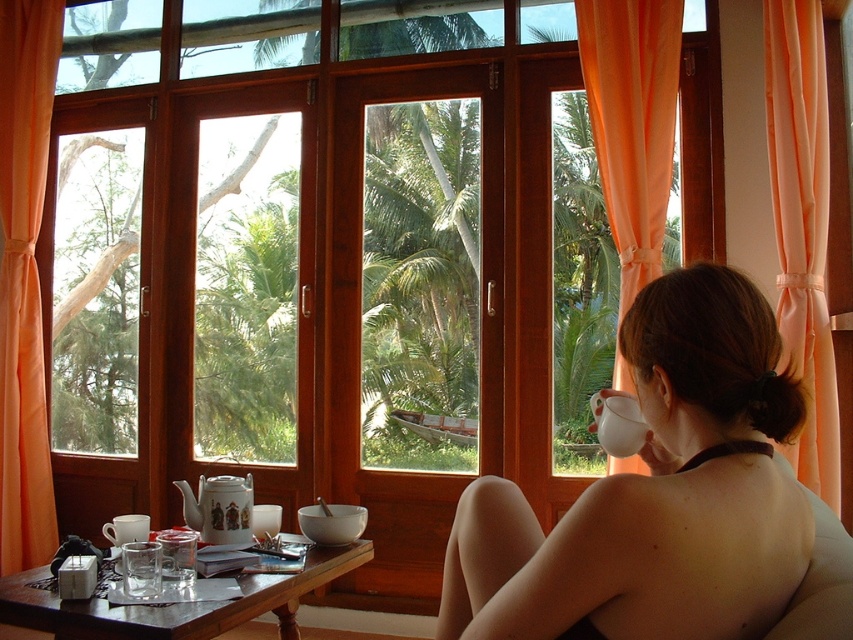
Question: Based on their relative distances, which object is farther from the orange sheer curtain at left?

Choices:
 (A) transparent glass cup at lower left
 (B) white matte cup at upper right

Answer: (B)

Question: Can you confirm if orange sheer curtain at left is smaller than transparent glass cup at lower left?

Choices:
 (A) yes
 (B) no

Answer: (B)

Question: Which of the following is the closest to the observer?

Choices:
 (A) white matte cup at upper right
 (B) smooth beige hair at center
 (C) brown wooden table at lower center
 (D) orange fabric curtain at right

Answer: (B)

Question: Which object is farther from the camera taking this photo?

Choices:
 (A) peach satin curtain at right
 (B) orange fabric curtain at right

Answer: (B)

Question: Does smooth beige hair at center appear over transparent glass cup at lower left?

Choices:
 (A) no
 (B) yes

Answer: (B)

Question: Is brown wooden table at lower center bigger than white matte cup at upper right?

Choices:
 (A) yes
 (B) no

Answer: (A)